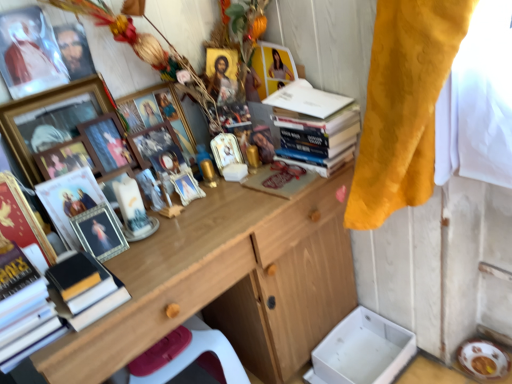
Find the location of a particular element. The height and width of the screenshot is (384, 512). vacant space that is in between hardcover book at left, the first book from the left, and hardcover books at upper right, the 1th book from the right is located at coordinates (206, 230).